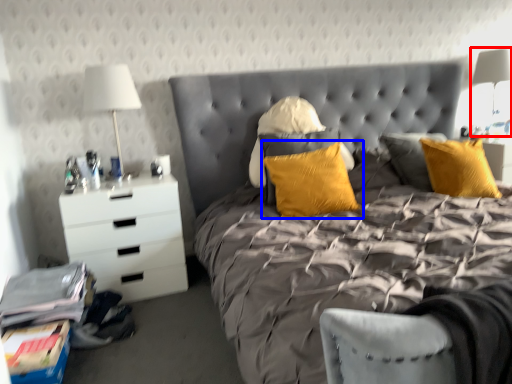
Question: Among these objects, which one is nearest to the camera, bedside lamp (highlighted by a red box) or pillow (highlighted by a blue box)?

Choices:
 (A) bedside lamp
 (B) pillow

Answer: (B)